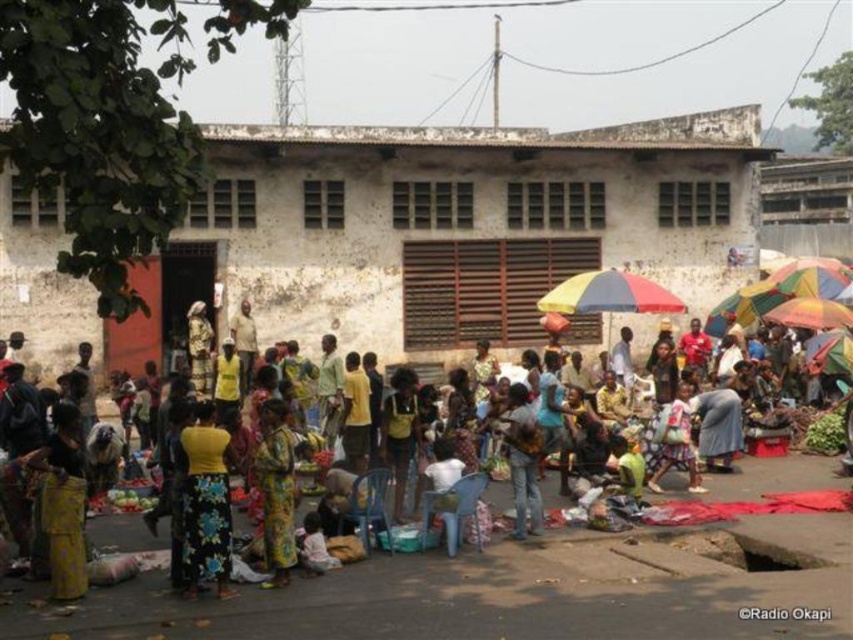
Question: Which of the following is the farthest from the observer?

Choices:
 (A) floral fabric market at center
 (B) yellow fabric skirt at lower left

Answer: (A)

Question: Among these objects, which one is farthest from the camera?

Choices:
 (A) rainbow fabric umbrella at center
 (B) printed fabric dress at center
 (C) yellow fabric skirt at lower left

Answer: (A)

Question: Which of the following is the closest to the observer?

Choices:
 (A) yellow fabric dress at center
 (B) rainbow fabric umbrella at center
 (C) printed fabric dress at center
 (D) yellow fabric skirt at lower left

Answer: (D)

Question: Is floral fabric market at center above rainbow fabric umbrella at center?

Choices:
 (A) yes
 (B) no

Answer: (B)

Question: Can you confirm if printed fabric dress at center is positioned below rainbow fabric umbrella at center?

Choices:
 (A) no
 (B) yes

Answer: (B)

Question: Where is yellow fabric skirt at lower left located in relation to rainbow fabric umbrella at center in the image?

Choices:
 (A) left
 (B) right

Answer: (A)